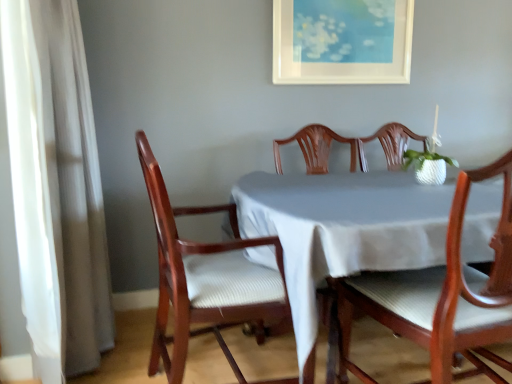
Find the location of a particular element. wooden chair at center, marked as the 1th chair in a right-to-left arrangement is located at coordinates pos(443,295).

Locate an element on the screen. wooden chair at left, the 1th chair viewed from the left is located at coordinates (205, 278).

What do you see at coordinates (342, 45) in the screenshot? This screenshot has height=384, width=512. I see `white matte picture frame at upper center` at bounding box center [342, 45].

Where is `wooden chair at center, marked as the 1th chair in a right-to-left arrangement`? The height and width of the screenshot is (384, 512). wooden chair at center, marked as the 1th chair in a right-to-left arrangement is located at coordinates (443, 295).

Does wooden chair at center, marked as the 1th chair in a right-to-left arrangement, have a greater width compared to white matte picture frame at upper center?

Correct, the width of wooden chair at center, marked as the 1th chair in a right-to-left arrangement, exceeds that of white matte picture frame at upper center.

Which point is more distant from viewer, (454, 194) or (371, 35)?

Point (371, 35)

From the image's perspective, count 2nd chairs downward from the white matte picture frame at upper center and point to it. Please provide its 2D coordinates.

[(443, 295)]

Is wooden chair at center, the 2th chair when ordered from left to right, closer to the viewer compared to white matte picture frame at upper center?

Yes, wooden chair at center, the 2th chair when ordered from left to right, is closer to the viewer.

Are white sheer curtain at left and wooden chair at center, the 2th chair when ordered from left to right, making contact?

No, white sheer curtain at left is not beside wooden chair at center, the 2th chair when ordered from left to right.

Consider the image. Which is behind, white sheer curtain at left or wooden chair at center, the 2th chair when ordered from left to right?

Positioned behind is white sheer curtain at left.

From the image's perspective, is white sheer curtain at left beneath wooden chair at center, marked as the 1th chair in a right-to-left arrangement?

No, from the image's perspective, white sheer curtain at left is not beneath wooden chair at center, marked as the 1th chair in a right-to-left arrangement.

Is point (47, 92) positioned before point (452, 304)?

That is False.

Is wooden chair at center, marked as the 1th chair in a right-to-left arrangement, bigger or smaller than white sheer curtain at left?

Considering their sizes, wooden chair at center, marked as the 1th chair in a right-to-left arrangement, takes up more space than white sheer curtain at left.

Between wooden chair at center, marked as the 1th chair in a right-to-left arrangement, and white sheer curtain at left, which one appears on the right side from the viewer's perspective?

Positioned to the right is wooden chair at center, marked as the 1th chair in a right-to-left arrangement.

Is wooden chair at center, marked as the 1th chair in a right-to-left arrangement, turned away from white sheer curtain at left?

wooden chair at center, marked as the 1th chair in a right-to-left arrangement, does not have its back to white sheer curtain at left.

Is wooden chair at center, the 2th chair when ordered from left to right, not near white sheer curtain at left?

Indeed, wooden chair at center, the 2th chair when ordered from left to right, is not near white sheer curtain at left.

From a real-world perspective, between white sheer curtain at left and white matte picture frame at upper center, who is vertically lower?

white sheer curtain at left is physically lower.

The image size is (512, 384). Find the location of `curtain below the white matte picture frame at upper center (from a real-world perspective)`. curtain below the white matte picture frame at upper center (from a real-world perspective) is located at coordinates (52, 191).

Is white sheer curtain at left positioned with its back to white matte picture frame at upper center?

That's not correct — white sheer curtain at left is not looking away from white matte picture frame at upper center.

Can you confirm if white matte picture frame at upper center is smaller than white sheer curtain at left?

Indeed, white matte picture frame at upper center has a smaller size compared to white sheer curtain at left.

Is point (401, 35) positioned after point (34, 171)?

That is True.

From a real-world perspective, is white matte picture frame at upper center beneath white sheer curtain at left?

Actually, white matte picture frame at upper center is physically above white sheer curtain at left in the real world.

You are a GUI agent. You are given a task and a screenshot of the screen. Output one action in this format:
    pyautogui.click(x=<x>, y=<y>)
    Task: Click on the picture frame that appears above the white sheer curtain at left (from the image's perspective)
    
    Given the screenshot: What is the action you would take?
    pyautogui.click(x=342, y=45)

Considering the relative sizes of wooden chair at left, placed as the 2th chair when sorted from right to left, and wooden chair at center, the 2th chair when ordered from left to right, in the image provided, is wooden chair at left, placed as the 2th chair when sorted from right to left, taller than wooden chair at center, the 2th chair when ordered from left to right,?

Yes, wooden chair at left, placed as the 2th chair when sorted from right to left, is taller than wooden chair at center, the 2th chair when ordered from left to right.

From a real-world perspective, which is physically above, wooden chair at left, placed as the 2th chair when sorted from right to left, or wooden chair at center, the 2th chair when ordered from left to right?

wooden chair at center, the 2th chair when ordered from left to right, from a real-world perspective.

Does wooden chair at left, the 1th chair viewed from the left, have a greater width compared to wooden chair at center, the 2th chair when ordered from left to right?

Indeed, wooden chair at left, the 1th chair viewed from the left, has a greater width compared to wooden chair at center, the 2th chair when ordered from left to right.

Is wooden chair at left, the 1th chair viewed from the left, facing away from wooden chair at center, marked as the 1th chair in a right-to-left arrangement?

No, wooden chair at left, the 1th chair viewed from the left, is not facing the opposite direction of wooden chair at center, marked as the 1th chair in a right-to-left arrangement.

Is white sheer curtain at left facing towards wooden chair at left, placed as the 2th chair when sorted from right to left?

Yes, white sheer curtain at left is turned towards wooden chair at left, placed as the 2th chair when sorted from right to left.

In the scene shown: Is white sheer curtain at left positioned beyond the bounds of wooden chair at left, placed as the 2th chair when sorted from right to left?

Yes.

Is white sheer curtain at left positioned in front of wooden chair at left, placed as the 2th chair when sorted from right to left?

No.

From the white matte picture frame at upper center, count 2nd chairs forward and point to it. Please provide its 2D coordinates.

[(443, 295)]

The height and width of the screenshot is (384, 512). Find the location of `curtain behind the wooden chair at center, marked as the 1th chair in a right-to-left arrangement`. curtain behind the wooden chair at center, marked as the 1th chair in a right-to-left arrangement is located at coordinates (52, 191).

Looking at the image, which one is located further to white matte picture frame at upper center, white sheer curtain at left or wooden chair at left, the 1th chair viewed from the left?

white sheer curtain at left is further to white matte picture frame at upper center.

Based on their spatial positions, is white matte picture frame at upper center or wooden chair at left, placed as the 2th chair when sorted from right to left, further from white sheer curtain at left?

white matte picture frame at upper center is positioned further to the anchor white sheer curtain at left.

Which object lies further to the anchor point wooden chair at left, placed as the 2th chair when sorted from right to left, white sheer curtain at left or white matte picture frame at upper center?

white matte picture frame at upper center is positioned further to the anchor wooden chair at left, placed as the 2th chair when sorted from right to left.

Estimate the real-world distances between objects in this image. Which object is closer to wooden chair at left, placed as the 2th chair when sorted from right to left, wooden chair at center, marked as the 1th chair in a right-to-left arrangement, or white matte picture frame at upper center?

wooden chair at center, marked as the 1th chair in a right-to-left arrangement, lies closer to wooden chair at left, placed as the 2th chair when sorted from right to left, than the other object.

Estimate the real-world distances between objects in this image. Which object is closer to white sheer curtain at left, wooden chair at center, the 2th chair when ordered from left to right, or wooden chair at left, the 1th chair viewed from the left?

The object closer to white sheer curtain at left is wooden chair at left, the 1th chair viewed from the left.

From the image, which object appears to be nearer to white sheer curtain at left, wooden chair at center, the 2th chair when ordered from left to right, or white matte picture frame at upper center?

wooden chair at center, the 2th chair when ordered from left to right, lies closer to white sheer curtain at left than the other object.

From the image, which object appears to be farther from wooden chair at center, marked as the 1th chair in a right-to-left arrangement, wooden chair at left, the 1th chair viewed from the left, or white matte picture frame at upper center?

white matte picture frame at upper center is positioned further to the anchor wooden chair at center, marked as the 1th chair in a right-to-left arrangement.

Considering their positions, is wooden chair at left, the 1th chair viewed from the left, positioned further to white sheer curtain at left than wooden chair at center, marked as the 1th chair in a right-to-left arrangement?

The object further to white sheer curtain at left is wooden chair at center, marked as the 1th chair in a right-to-left arrangement.

Identify the location of picture frame between white sheer curtain at left and wooden chair at center, the 2th chair when ordered from left to right. (342, 45).

I want to click on curtain located between wooden chair at left, the 1th chair viewed from the left, and white matte picture frame at upper center in the depth direction, so click(52, 191).

This screenshot has height=384, width=512. What are the coordinates of `chair between white sheer curtain at left and wooden chair at center, the 2th chair when ordered from left to right` in the screenshot? It's located at (205, 278).

At what (x,y) coordinates should I click in order to perform the action: click on chair between wooden chair at center, the 2th chair when ordered from left to right, and white matte picture frame at upper center in the front-back direction. Please return your answer as a coordinate pair (x, y). The height and width of the screenshot is (384, 512). Looking at the image, I should click on (205, 278).